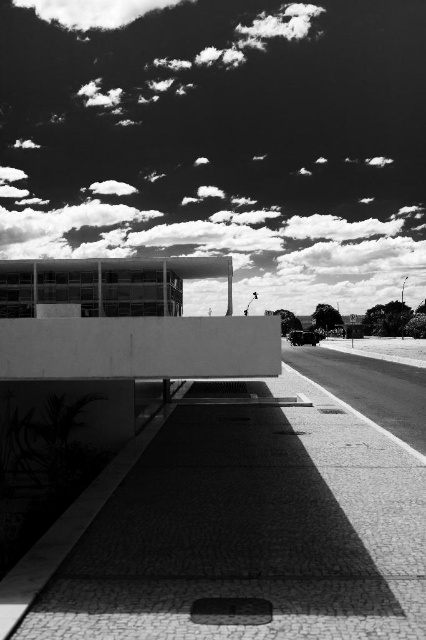
Question: Which object appears farthest from the camera in this image?

Choices:
 (A) white fluffy cloud at upper center
 (B) cloudy sky at upper center

Answer: (A)

Question: Is cloudy sky at upper center smaller than white fluffy cloud at upper center?

Choices:
 (A) yes
 (B) no

Answer: (B)

Question: Is the position of cloudy sky at upper center less distant than that of white fluffy cloud at upper center?

Choices:
 (A) no
 (B) yes

Answer: (B)

Question: Which point appears closest to the camera in this image?

Choices:
 (A) (276, 209)
 (B) (72, 10)

Answer: (A)

Question: In this image, where is cloudy sky at upper center located relative to white fluffy cloud at upper center?

Choices:
 (A) below
 (B) above

Answer: (A)

Question: Among these objects, which one is nearest to the camera?

Choices:
 (A) cloudy sky at upper center
 (B) white fluffy cloud at upper center

Answer: (A)